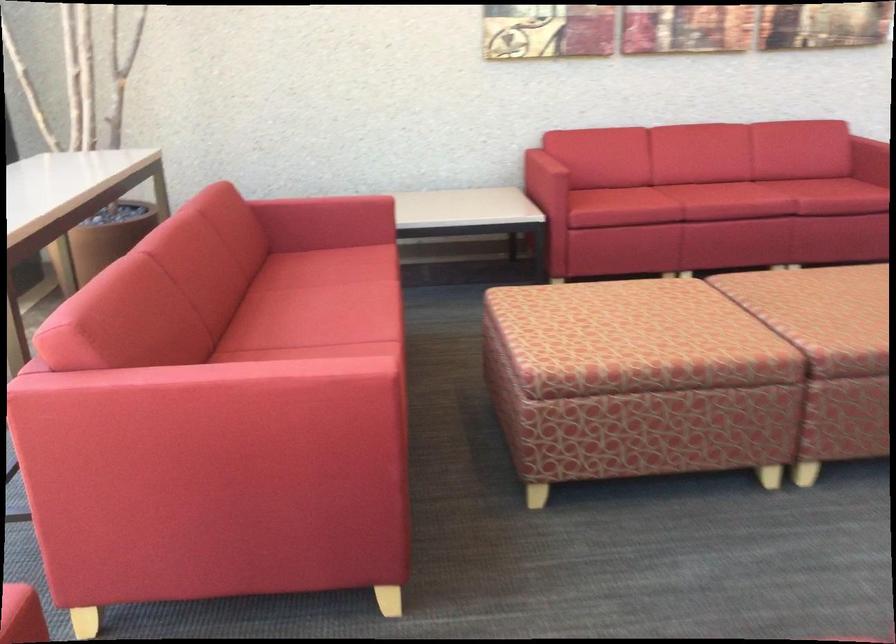
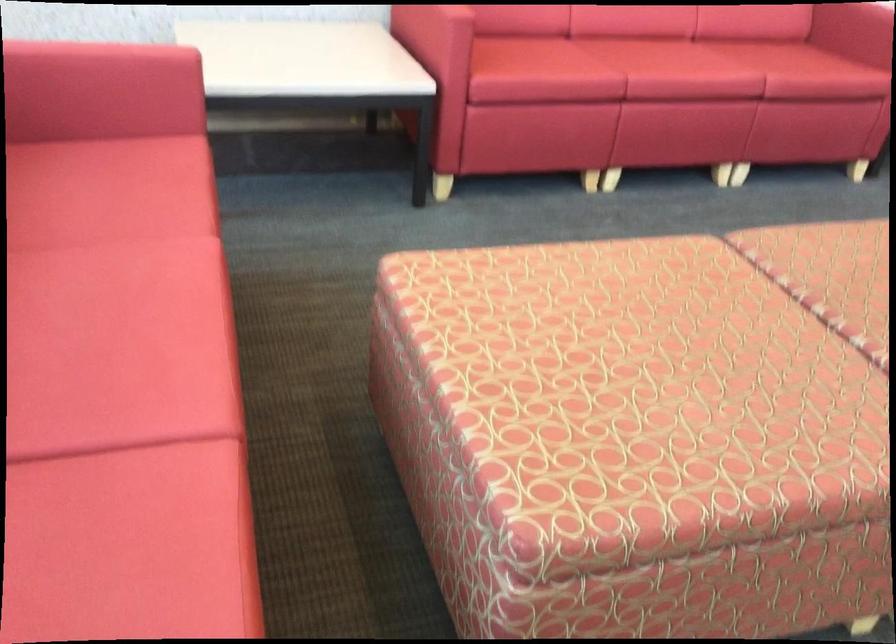
Question: What movement of the cameraman would produce the second image?

Choices:
 (A) Left
 (B) Right
 (C) Forward
 (D) Backward

Answer: (C)